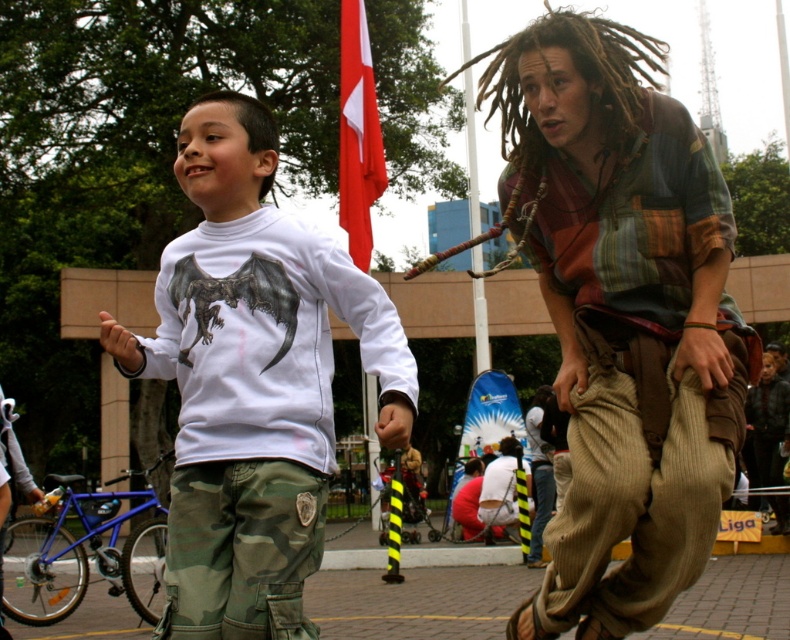
You are a photographer trying to capture a candid shot of the adult male with dreadlocks. You notice the multicolored patchwork shirt at center and brown corduroy pants at center. Which clothing item would be visible first in your camera frame if you focus on the lower half of his body?

The brown corduroy pants at center would be visible first in your camera frame when focusing on the lower half of the body because the multicolored patchwork shirt at center is above it, meaning the pants are lower and closer to the focused area.